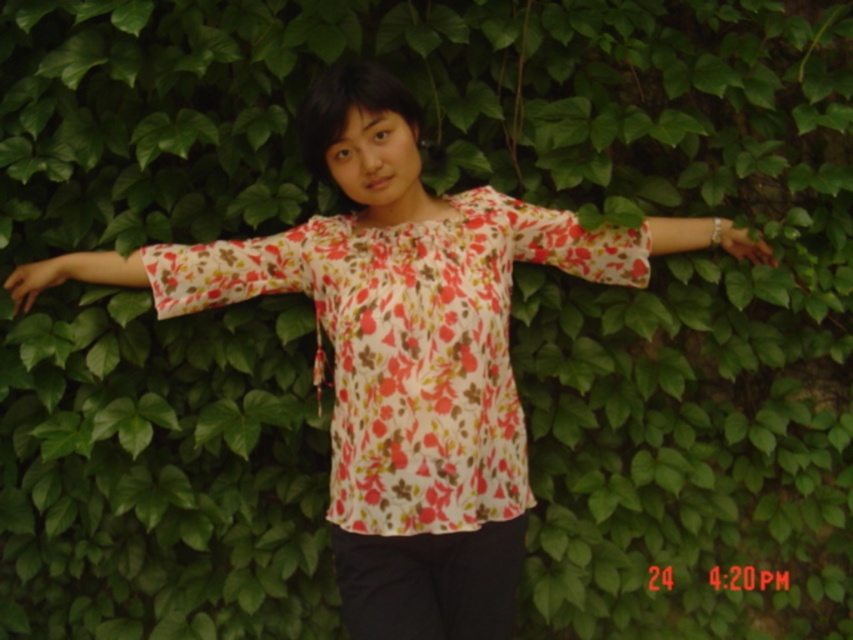
You are a fashion designer observing the image of a person wearing a floral patterned blouse and holding out their arms. You need to determine the spatial relationship between the floral fabric arm at left and the matte floral shirt at left. Which object is wider?

The floral fabric arm at left is wider than the matte floral shirt at left according to the description.

You are a photographer trying to capture the exact position of the floral fabric arm at center in the image. According to the coordinates given, where should you focus your camera? Please provide the coordinates in the format of a point like this example format of point format like this example format of point format like this example format of point format like this example format of point format like this example format of point format like this example format of point format like this example format of a

The floral fabric arm at center is located at point coordinates of (627, 243).

You are taking a photo of the person in the scene. You want to focus on the point closer to the camera. Which point should you choose between point (x=646, y=221) and point (x=737, y=256)?

Point (x=646, y=221) is closer to the camera than point (x=737, y=256), so you should choose point (x=646, y=221) to focus on.